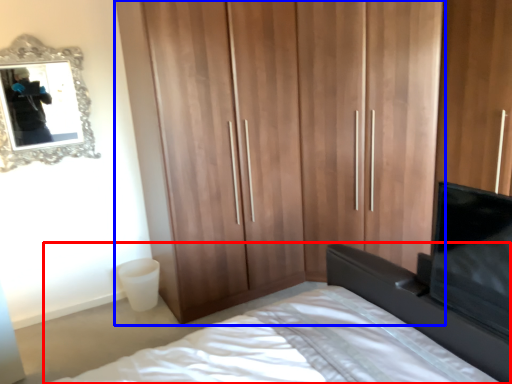
Question: Which object appears closest to the camera in this image, bed (highlighted by a red box) or cupboard (highlighted by a blue box)?

Choices:
 (A) bed
 (B) cupboard

Answer: (A)